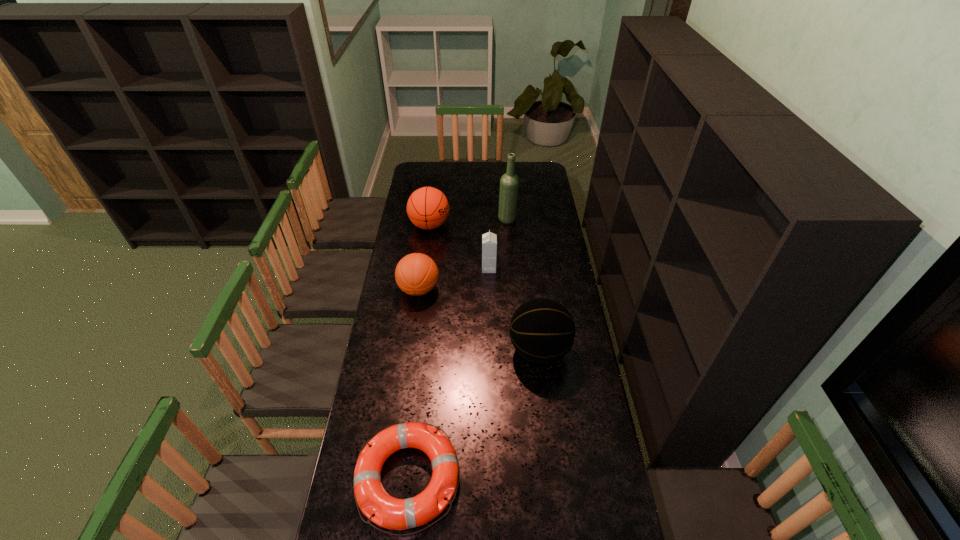
The image size is (960, 540). What are the coordinates of `vacant area situated 0.280m on the left of the tallest object` in the screenshot? It's located at (446, 220).

Image resolution: width=960 pixels, height=540 pixels. Identify the location of free region located 0.120m on the left of the rightmost basketball. (478, 350).

Where is `vacant space located on the side with logo of the farthest basketball`? vacant space located on the side with logo of the farthest basketball is located at coordinates (517, 225).

This screenshot has width=960, height=540. I want to click on free space located 0.220m on the front label of the third farthest object, so click(x=437, y=268).

Locate an element on the screen. The height and width of the screenshot is (540, 960). blank area located on the front label of the third farthest object is located at coordinates (471, 268).

At what (x,y) coordinates should I click in order to perform the action: click on vacant area located on the front label of the third farthest object. Please return your answer as a coordinate pair (x, y). This screenshot has height=540, width=960. Looking at the image, I should click on pyautogui.click(x=469, y=268).

Locate an element on the screen. free spot located on the back of the shortest basketball is located at coordinates (428, 224).

Where is `vacant space located on the right of the nearest object`? The width and height of the screenshot is (960, 540). vacant space located on the right of the nearest object is located at coordinates (572, 478).

Where is `life buoy that is at the left edge`? The height and width of the screenshot is (540, 960). life buoy that is at the left edge is located at coordinates (392, 513).

The width and height of the screenshot is (960, 540). I want to click on object present at the right edge, so click(x=542, y=331).